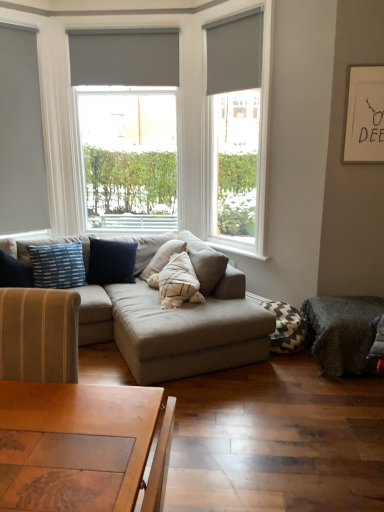
Locate an element on the screen. matte gray couch at center is located at coordinates (133, 329).

You are a GUI agent. You are given a task and a screenshot of the screen. Output one action in this format:
    pyautogui.click(x=<x>, y=<y>)
    Task: Click on the white paper at upper right
    The image size is (384, 512).
    Given the screenshot: What is the action you would take?
    pyautogui.click(x=364, y=115)

Image resolution: width=384 pixels, height=512 pixels. In order to click on matte gray roller shade at upper right, which ranks as the 3th window in left-to-right order in this screenshot , I will do `click(237, 126)`.

The height and width of the screenshot is (512, 384). In order to click on matte gray blind at upper right, acting as the 1th blind starting from the right in this screenshot , I will do `click(235, 52)`.

Where is `chevron-patterned fabric pillow at lower right, the second pillow in the left-to-right sequence`? Image resolution: width=384 pixels, height=512 pixels. chevron-patterned fabric pillow at lower right, the second pillow in the left-to-right sequence is located at coordinates (288, 328).

Does matte gray blind at upper center, the 2th blind in the front-to-back sequence, have a greater width compared to matte gray roller shade at upper right, placed as the first window when sorted from right to left?

No.

Is point (126, 63) positioned before point (256, 27)?

No, (126, 63) is further to viewer.

Is matte gray roller shade at upper right, which ranks as the 3th window in left-to-right order, at the back of matte gray blind at upper center, the 1th blind from the left?

No, matte gray blind at upper center, the 1th blind from the left,'s orientation is not away from matte gray roller shade at upper right, which ranks as the 3th window in left-to-right order.

Is matte gray roller shade at upper right, which ranks as the 3th window in left-to-right order, positioned far away from matte gray blind at upper right, acting as the second blind starting from the left?

That's right, there is a large distance between matte gray roller shade at upper right, which ranks as the 3th window in left-to-right order, and matte gray blind at upper right, acting as the second blind starting from the left.

Is matte gray roller shade at upper right, placed as the first window when sorted from right to left, completely or partially outside of matte gray blind at upper right, the 2th blind from the back?

Absolutely, matte gray roller shade at upper right, placed as the first window when sorted from right to left, is external to matte gray blind at upper right, the 2th blind from the back.

From the image's perspective, which one is positioned higher, matte gray roller shade at upper right, placed as the first window when sorted from right to left, or matte gray blind at upper right, placed as the first blind when sorted from front to back?

matte gray blind at upper right, placed as the first blind when sorted from front to back, from the image's perspective.

Identify the location of the 1st blind positioned above the matte gray roller shade at upper right, placed as the first window when sorted from right to left (from a real-world perspective). (235, 52).

Is dark gray plush footrest at lower right inside chevron-patterned fabric pillow at lower right, the 1th pillow when ordered from right to left?

No, chevron-patterned fabric pillow at lower right, the 1th pillow when ordered from right to left, does not contain dark gray plush footrest at lower right.

In the scene shown: Between chevron-patterned fabric pillow at lower right, the second pillow in the left-to-right sequence, and dark gray plush footrest at lower right, which one has larger size?

dark gray plush footrest at lower right.

From the image's perspective, which object appears higher, chevron-patterned fabric pillow at lower right, the second pillow in the left-to-right sequence, or dark gray plush footrest at lower right?

dark gray plush footrest at lower right appears higher in the image.

Locate an element on the screen. pillow below the dark gray plush footrest at lower right (from the image's perspective) is located at coordinates (288, 328).

Looking at their sizes, would you say dark gray plush footrest at lower right is wider or thinner than matte gray roller shade at center, which appears as the second window when viewed from the left?

Clearly, dark gray plush footrest at lower right has more width compared to matte gray roller shade at center, which appears as the second window when viewed from the left.

The width and height of the screenshot is (384, 512). In order to click on the footrest below the matte gray roller shade at center, which appears as the second window when viewed from the left (from the image's perspective) in this screenshot , I will do `click(343, 332)`.

Considering the positions of objects dark gray plush footrest at lower right and matte gray roller shade at center, which appears as the second window when viewed from the left, in the image provided, who is more to the left, dark gray plush footrest at lower right or matte gray roller shade at center, which appears as the second window when viewed from the left,?

matte gray roller shade at center, which appears as the second window when viewed from the left.

From the image's perspective, is dark gray plush footrest at lower right on top of matte gray roller shade at center, the second window viewed from the right?

No, from the image's perspective, dark gray plush footrest at lower right is not over matte gray roller shade at center, the second window viewed from the right.

Can you tell me how much blue striped pillow at left, which is the second pillow in bottom-to-top order, and matte gray blind at upper center, which is the second blind from right to left, differ in facing direction?

The facing directions of blue striped pillow at left, which is the second pillow in bottom-to-top order, and matte gray blind at upper center, which is the second blind from right to left, are 30.6 degrees apart.

From the picture: Considering the relative sizes of blue striped pillow at left, which ranks as the 1th pillow in top-to-bottom order, and matte gray blind at upper center, which is the second blind from right to left, in the image provided, is blue striped pillow at left, which ranks as the 1th pillow in top-to-bottom order, wider than matte gray blind at upper center, which is the second blind from right to left,?

Correct, the width of blue striped pillow at left, which ranks as the 1th pillow in top-to-bottom order, exceeds that of matte gray blind at upper center, which is the second blind from right to left.

From the image's perspective, which is below, blue striped pillow at left, which is the second pillow in bottom-to-top order, or matte gray blind at upper center, the 2th blind in the front-to-back sequence?

blue striped pillow at left, which is the second pillow in bottom-to-top order, from the image's perspective.

From a real-world perspective, which is physically below, blue striped pillow at left, which is the 2th pillow from right to left, or matte gray blind at upper center, which is the second blind from right to left?

blue striped pillow at left, which is the 2th pillow from right to left, from a real-world perspective.

Is point (297, 345) closer or farther from the camera than point (383, 141)?

Point (297, 345) is farther from the camera than point (383, 141).

Is the surface of chevron-patterned fabric pillow at lower right, marked as the first pillow in a bottom-to-top arrangement, in direct contact with white paper at upper right?

No, chevron-patterned fabric pillow at lower right, marked as the first pillow in a bottom-to-top arrangement, is not beside white paper at upper right.

Does chevron-patterned fabric pillow at lower right, the 1th pillow when ordered from right to left, have a smaller size compared to white paper at upper right?

Incorrect, chevron-patterned fabric pillow at lower right, the 1th pillow when ordered from right to left, is not smaller in size than white paper at upper right.

In the scene shown: From the image's perspective, is chevron-patterned fabric pillow at lower right, marked as the first pillow in a bottom-to-top arrangement, under white paper at upper right?

Indeed, from the image's perspective, chevron-patterned fabric pillow at lower right, marked as the first pillow in a bottom-to-top arrangement, is shown beneath white paper at upper right.

Considering the positions of point (56, 251) and point (267, 105), is point (56, 251) closer or farther from the camera than point (267, 105)?

Point (56, 251) appears to be farther away from the viewer than point (267, 105).

From the image's perspective, which pillow is the 1st one below the matte gray roller shade at upper right, which ranks as the 3th window in left-to-right order? Please provide its 2D coordinates.

[(58, 265)]

Which object is further away from the camera taking this photo, blue striped pillow at left, which is the second pillow in bottom-to-top order, or matte gray roller shade at upper right, placed as the first window when sorted from right to left?

blue striped pillow at left, which is the second pillow in bottom-to-top order, is more distant.

Find the location of a particular element. blind that is the 2nd object to the left of the matte gray roller shade at upper right, placed as the first window when sorted from right to left, starting at the anchor is located at coordinates (124, 57).

In order to click on window in front of the matte gray blind at upper right, acting as the second blind starting from the left in this screenshot , I will do `click(237, 126)`.

When comparing their distances from dark gray plush footrest at lower right, does white paper at upper right or blue striped pillow at left, which is the second pillow in bottom-to-top order, seem closer?

white paper at upper right.

Which object lies nearer to the anchor point matte gray couch at center, blue striped pillow at left, which is the 2th pillow from right to left, or matte gray roller shade at upper right, which ranks as the 3th window in left-to-right order?

blue striped pillow at left, which is the 2th pillow from right to left.

Based on their spatial positions, is matte gray roller shade at upper right, which ranks as the 3th window in left-to-right order, or matte gray roller shade at center, the second window viewed from the right, further from white paper at upper right?

The object further to white paper at upper right is matte gray roller shade at upper right, which ranks as the 3th window in left-to-right order.

Which object lies nearer to the anchor point gray matte roller blind at left, the 3th window when ordered from right to left, chevron-patterned fabric pillow at lower right, the second pillow in the top-to-bottom sequence, or matte gray blind at upper right, acting as the 1th blind starting from the right?

matte gray blind at upper right, acting as the 1th blind starting from the right, is positioned closer to the anchor gray matte roller blind at left, the 3th window when ordered from right to left.

Looking at the image, which one is located closer to white paper at upper right, gray matte roller blind at left, the 3th window when ordered from right to left, or matte gray roller shade at upper right, placed as the first window when sorted from right to left?

matte gray roller shade at upper right, placed as the first window when sorted from right to left, lies closer to white paper at upper right than the other object.

Which object lies nearer to the anchor point white painted wood at center, blue striped pillow at left, which ranks as the 1th pillow in top-to-bottom order, or matte gray blind at upper center, the 2th blind in the front-to-back sequence?

Among the two, blue striped pillow at left, which ranks as the 1th pillow in top-to-bottom order, is located nearer to white painted wood at center.

When comparing their distances from matte gray roller shade at upper right, which ranks as the 3th window in left-to-right order, does matte gray blind at upper right, the 2th blind from the back, or matte gray roller shade at center, which appears as the second window when viewed from the left, seem closer?

The object closer to matte gray roller shade at upper right, which ranks as the 3th window in left-to-right order, is matte gray blind at upper right, the 2th blind from the back.

Based on their spatial positions, is blue striped pillow at left, placed as the 1th pillow when sorted from left to right, or matte gray couch at center closer to gray matte roller blind at left, the 3th window when ordered from right to left?

blue striped pillow at left, placed as the 1th pillow when sorted from left to right, is positioned closer to the anchor gray matte roller blind at left, the 3th window when ordered from right to left.

Identify the location of window sill that lies between matte gray blind at upper center, the 1th blind from the left, and dark gray plush footrest at lower right from top to bottom. (238, 251).

I want to click on pillow between gray matte roller blind at left, placed as the first window when sorted from left to right, and chevron-patterned fabric pillow at lower right, the second pillow in the left-to-right sequence, so click(x=58, y=265).

This screenshot has width=384, height=512. Identify the location of pillow between gray matte roller blind at left, placed as the first window when sorted from left to right, and matte gray roller shade at upper right, which ranks as the 3th window in left-to-right order. (58, 265).

At what (x,y) coordinates should I click in order to perform the action: click on blind between matte gray blind at upper center, which is the second blind from right to left, and matte gray roller shade at upper right, placed as the first window when sorted from right to left, in the horizontal direction. Please return your answer as a coordinate pair (x, y). Looking at the image, I should click on (235, 52).